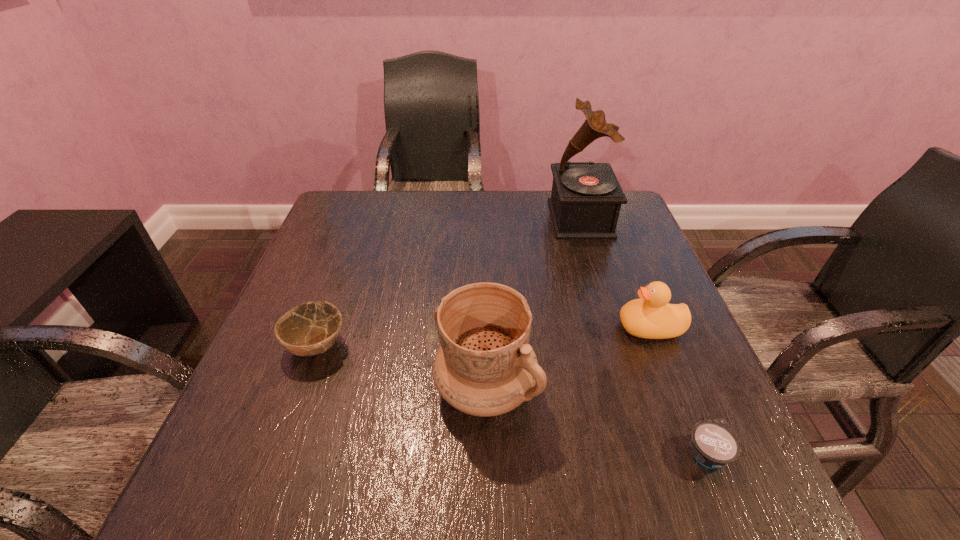
The width and height of the screenshot is (960, 540). In order to click on empty space that is in between the leftmost object and the pottery in this screenshot , I will do `click(401, 367)`.

At what (x,y) coordinates should I click in order to perform the action: click on object that is the closest to the third shortest object. Please return your answer as a coordinate pair (x, y). Looking at the image, I should click on (485, 366).

At what (x,y) coordinates should I click in order to perform the action: click on object that stands as the fourth closest to the shortest object. Please return your answer as a coordinate pair (x, y). This screenshot has width=960, height=540. Looking at the image, I should click on (308, 329).

Locate an element on the screen. Image resolution: width=960 pixels, height=540 pixels. free space that satisfies the following two spatial constraints: 1. on the front side of the leftmost object; 2. on the right side of the fourth object from right to left is located at coordinates (301, 388).

The height and width of the screenshot is (540, 960). I want to click on free location that satisfies the following two spatial constraints: 1. on the face of the third shortest object; 2. on the front side of the fourth object from right to left, so click(674, 388).

Identify the location of vacant position in the image that satisfies the following two spatial constraints: 1. at the horn opening of the farthest object; 2. on the back side of the yogurt. (653, 453).